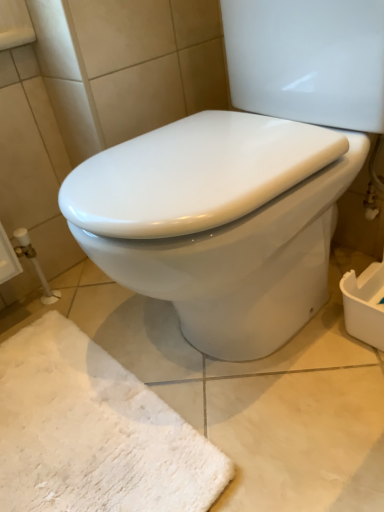
The height and width of the screenshot is (512, 384). Identify the location of empty space that is ontop of white fluffy bath mat at lower left (from a real-world perspective). (82, 385).